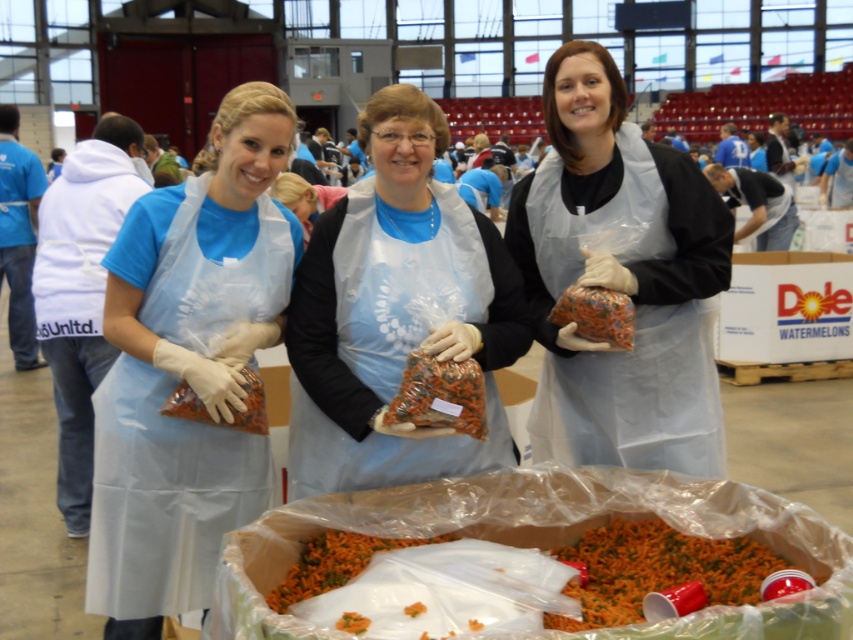
Question: In this image, where is matte plastic apron at center located relative to multicolored woven fabric bag at center?

Choices:
 (A) left
 (B) right

Answer: (A)

Question: Which object appears closest to the camera in this image?

Choices:
 (A) matte plastic apron at center
 (B) matte plastic bag of dried fruits at center
 (C) clear plastic apron at center
 (D) carrot shredded at center

Answer: (D)

Question: Which point is closer to the camera?

Choices:
 (A) orange shredded carrots at center
 (B) orange dried fruit at center

Answer: (A)

Question: Is matte plastic bag of dried fruits at center to the right of blue apron at center from the viewer's perspective?

Choices:
 (A) no
 (B) yes

Answer: (B)

Question: Which point is farther to the camera?

Choices:
 (A) (280, 188)
 (B) (244, 392)
 (C) (634, 552)
 (D) (405, 200)

Answer: (A)

Question: Is clear plastic apron at center bigger than carrot shredded at center?

Choices:
 (A) yes
 (B) no

Answer: (A)